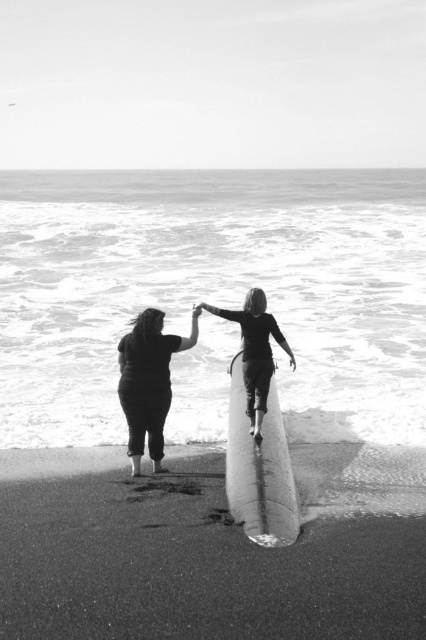
You are a photographer trying to capture the perfect shot of the two surfers and their surfboards. Since you want to ensure the surfboards are clearly visible in the frame, which surfboard among the white smooth surfboard at center and the matte black surfboard at center would be easier to see against the dark wet sand?

The white smooth surfboard at center would be easier to see against the dark wet sand because it has higher contrast compared to the matte black surfboard at center, which might blend in more with the dark tones of the sand.

You are standing at the beach and see the white foam water at center and the white smooth surfboard at center. Which object is closer to you?

The white foam water at center is closer to you because it is positioned further to the viewer than the white smooth surfboard at center.